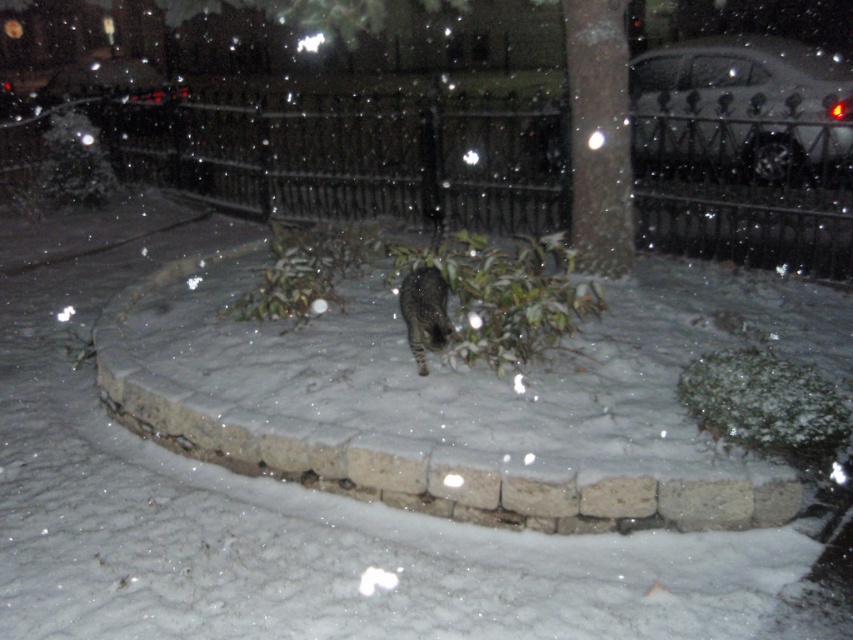
You are a photographer trying to capture both the dark brown bark at center and the tabby fur cat at center in a single shot. Which object should you focus on first to ensure both are in frame?

The dark brown bark at center is larger in size than the tabby fur cat at center, so you should focus on the dark brown bark at center first to ensure both fit in the frame.

You are standing at the edge of the snowy ground and want to place a small decorative garden gnome exactly where the white fluffy snow at center is located. According to the image, what are the coordinates where you should place the gnome?

The coordinates for placing the garden gnome are at point (x=115, y=465) where the white fluffy snow at center is located.

You are a cat trying to dig through the snow to reach the plants. Based on the scene, which object is located above the other between the white fluffy snow at center and the dark brown bark at center?

The dark brown bark at center is above the white fluffy snow at center because the snow is below the bark.